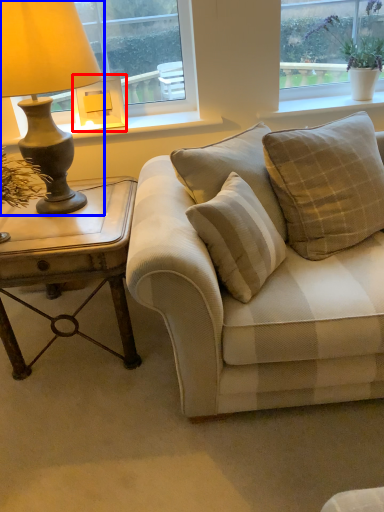
Question: Which object is further to the camera taking this photo, lamp (highlighted by a red box) or lamp (highlighted by a blue box)?

Choices:
 (A) lamp
 (B) lamp

Answer: (A)